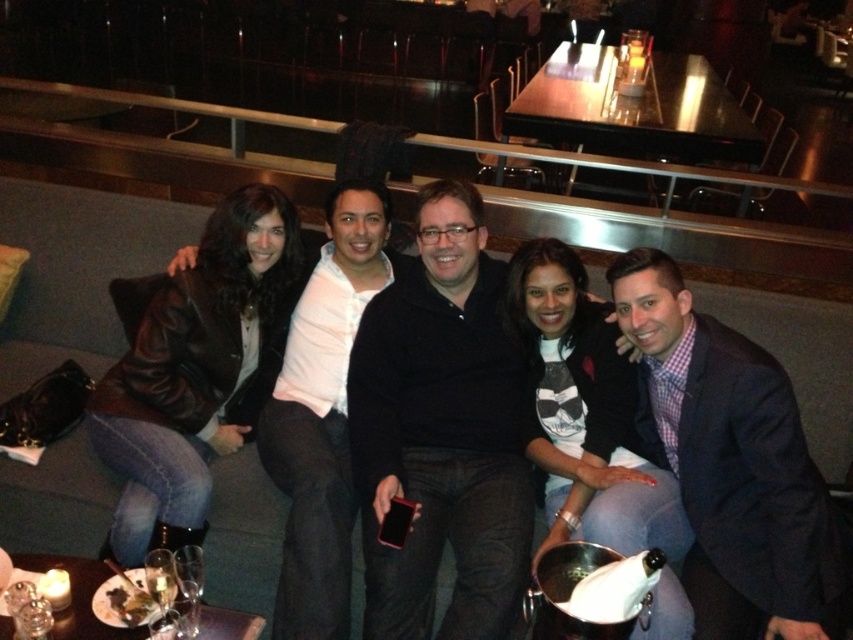
You are a photographer setting up for a group photo. You need to place a light to the right of the dark blue suit at right and to the left of the leather jacket at left. Is this possible?

The dark blue suit at right is to the right of the leather jacket at left, so placing the light between them would require it to be to the right of the leather jacket at left and to the left of the dark blue suit at right. This placement is possible as they are positioned in a line from left to right as leather jacket at left then dark blue suit at right.

You are a photographer adjusting the lighting for a group photo. You notice the dark blue suit at right and the white shirt at center. Which clothing item should you focus the light on to ensure it stands out more, considering their sizes?

The white shirt at center is taller than the dark blue suit at right, so focusing the light on the white shirt at center would make it stand out more due to its greater height.

You are a photographer setting up for a group photo in a bar. You notice a matte black jacket at center and a white shirt at center in the scene. Which object should you adjust to ensure both items are visible in the frame without overlapping?

The matte black jacket at center occupies less space than the white shirt at center. To ensure both items are visible without overlapping, adjust the matte black jacket at center since it takes up less space and can be moved more easily.